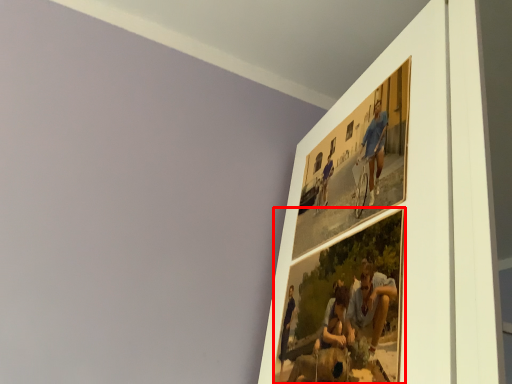
Question: From the image, what is the correct spatial relationship of picture frame (annotated by the red box) in relation to picture frame?

Choices:
 (A) left
 (B) right

Answer: (A)